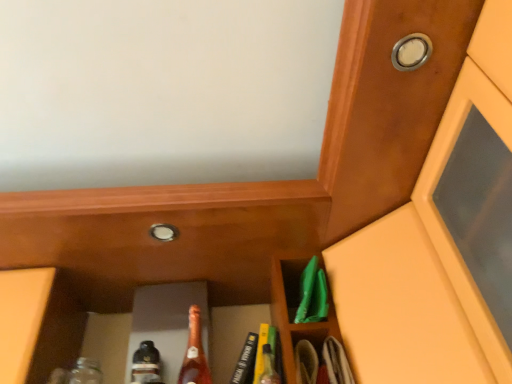
Question: Is metallic silver knob at upper right, acting as the 1th knob starting from the front, wider than matte glass bottle at center?

Choices:
 (A) no
 (B) yes

Answer: (A)

Question: Considering the relative sizes of metallic silver knob at upper right, which is the 1th knob in right-to-left order, and matte glass bottle at center in the image provided, is metallic silver knob at upper right, which is the 1th knob in right-to-left order, taller than matte glass bottle at center?

Choices:
 (A) yes
 (B) no

Answer: (B)

Question: Is metallic silver knob at upper right, marked as the second knob in a bottom-to-top arrangement, facing towards matte glass bottle at center?

Choices:
 (A) yes
 (B) no

Answer: (B)

Question: Does metallic silver knob at upper right, the 2th knob positioned from the left, come in front of matte glass bottle at center?

Choices:
 (A) no
 (B) yes

Answer: (B)

Question: From the image's perspective, would you say metallic silver knob at upper right, marked as the second knob in a bottom-to-top arrangement, is positioned over matte glass bottle at center?

Choices:
 (A) no
 (B) yes

Answer: (B)

Question: Considering the positions of wooden door at upper right and matte glass bottle at center in the image, is wooden door at upper right wider or thinner than matte glass bottle at center?

Choices:
 (A) wide
 (B) thin

Answer: (A)

Question: Is wooden door at upper right spatially inside matte glass bottle at center, or outside of it?

Choices:
 (A) inside
 (B) outside

Answer: (B)

Question: Is wooden door at upper right in front of or behind matte glass bottle at center in the image?

Choices:
 (A) behind
 (B) front

Answer: (B)

Question: From their relative heights in the image, would you say wooden door at upper right is taller or shorter than matte glass bottle at center?

Choices:
 (A) short
 (B) tall

Answer: (B)

Question: Is matte brown cabinet at center bigger or smaller than metallic silver knob at upper right, the 2th knob positioned from the left?

Choices:
 (A) big
 (B) small

Answer: (A)

Question: Is matte brown cabinet at center wider or thinner than metallic silver knob at upper right, acting as the 1th knob starting from the front?

Choices:
 (A) thin
 (B) wide

Answer: (B)

Question: Is matte brown cabinet at center to the left or to the right of metallic silver knob at upper right, acting as the 1th knob starting from the front, in the image?

Choices:
 (A) left
 (B) right

Answer: (A)

Question: Considering the positions of point (103, 221) and point (411, 61), is point (103, 221) closer or farther from the camera than point (411, 61)?

Choices:
 (A) farther
 (B) closer

Answer: (A)

Question: Considering the positions of wooden door at upper right and matte brown cabinet at center in the image, is wooden door at upper right wider or thinner than matte brown cabinet at center?

Choices:
 (A) thin
 (B) wide

Answer: (B)

Question: In terms of height, does wooden door at upper right look taller or shorter compared to matte brown cabinet at center?

Choices:
 (A) short
 (B) tall

Answer: (B)